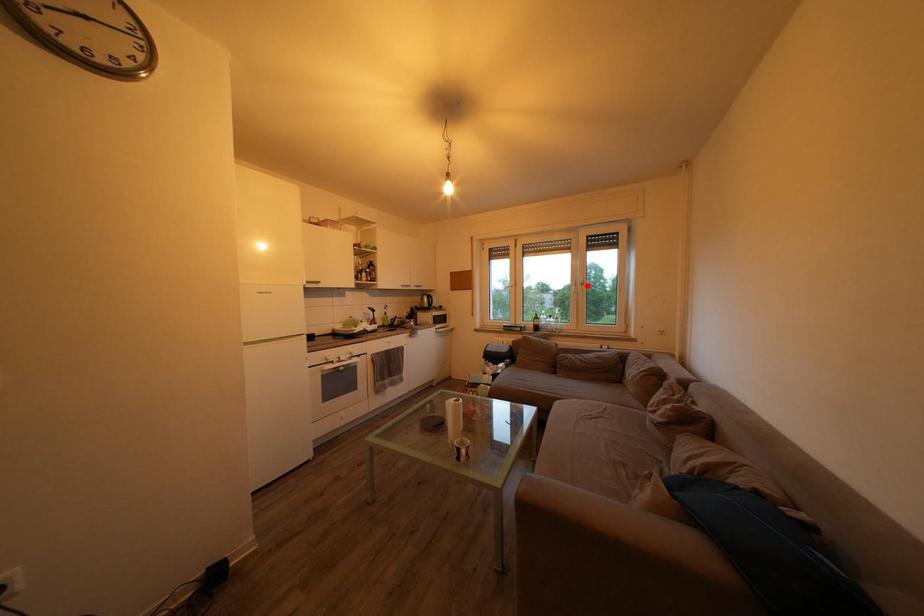
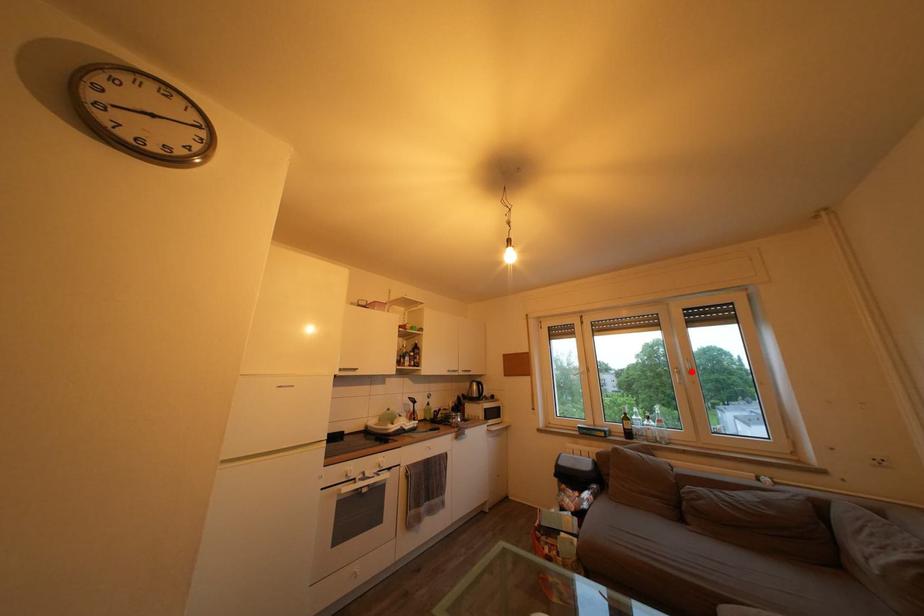
I am providing you with two images of the same scene from different viewpoints. A red point is marked on the first image and another point is marked on the second image. Is the marked point in image1 the same physical position as the marked point in image2?

Yes